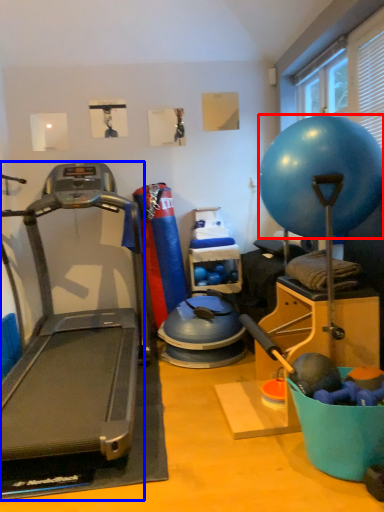
Question: Among these objects, which one is farthest to the camera, ball (highlighted by a red box) or treadmill (highlighted by a blue box)?

Choices:
 (A) ball
 (B) treadmill

Answer: (A)